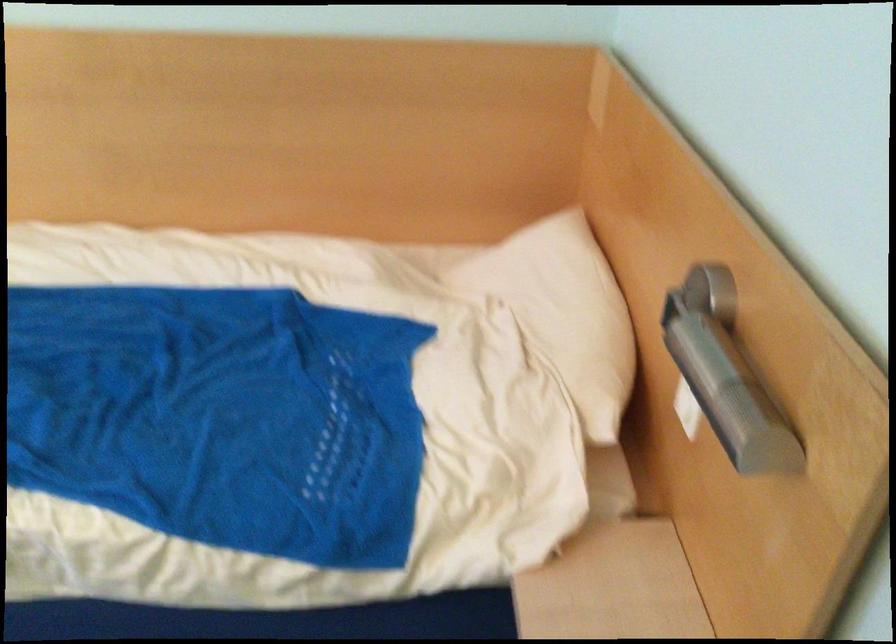
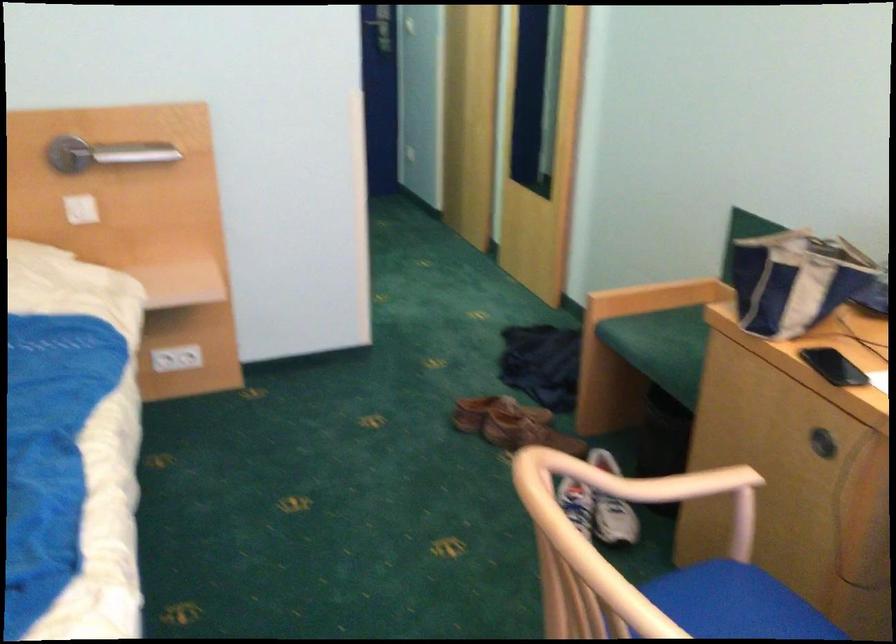
Where in the second image is the point corresponding to (699,355) from the first image?

(105, 154)